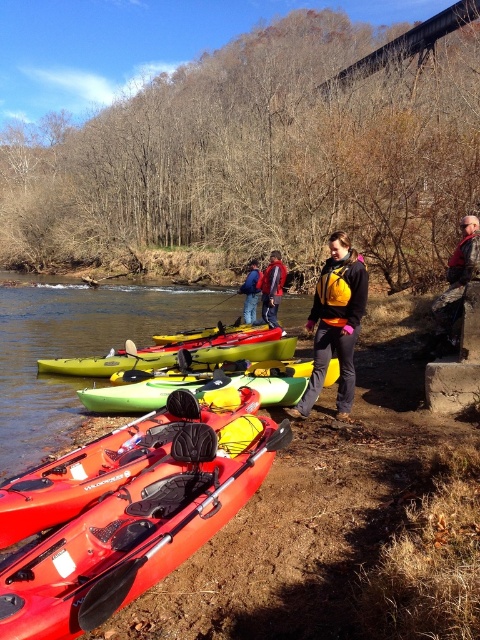
Is camouflage fabric jacket at right to the left of blue denim jacket at center from the viewer's perspective?

Incorrect, camouflage fabric jacket at right is not on the left side of blue denim jacket at center.

Does point (446, 312) come closer to viewer compared to point (271, 262)?

Yes, point (446, 312) is in front of point (271, 262).

Is point (448, 305) positioned behind point (276, 284)?

No, (448, 305) is closer to viewer.

I want to click on camouflage fabric jacket at right, so click(x=456, y=285).

Can you confirm if yellow life vest at center is positioned to the right of black rubber paddle at lower left?

Indeed, yellow life vest at center is positioned on the right side of black rubber paddle at lower left.

Who is lower down, yellow life vest at center or black rubber paddle at lower left?

Positioned lower is black rubber paddle at lower left.

Who is more distant from viewer, [315,301] or [159,548]?

Positioned behind is point [315,301].

What are the coordinates of `yellow life vest at center` in the screenshot? It's located at click(x=336, y=323).

Is camouflage fabric jacket at right positioned behind yellow rubber paddle at center?

No, camouflage fabric jacket at right is in front of yellow rubber paddle at center.

Is camouflage fabric jacket at right bigger than yellow rubber paddle at center?

Indeed, camouflage fabric jacket at right has a larger size compared to yellow rubber paddle at center.

Locate an element on the screen. The image size is (480, 640). camouflage fabric jacket at right is located at coordinates (456, 285).